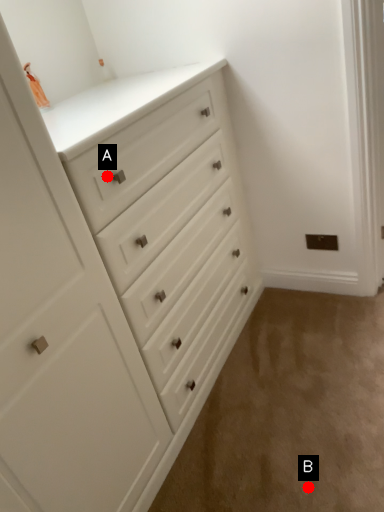
Question: Two points are circled on the image, labeled by A and B beside each circle. Which point is closer to the camera taking this photo?

Choices:
 (A) A is closer
 (B) B is closer

Answer: (A)